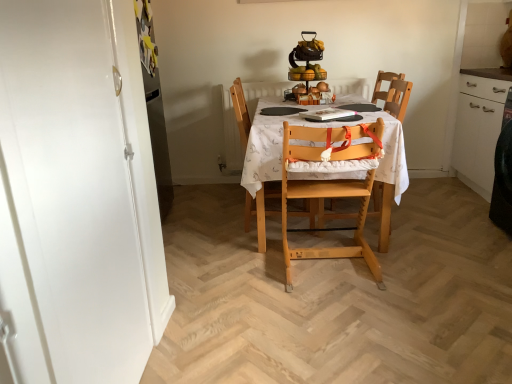
How much space does wooden highchair at center, arranged as the third chair when viewed from the left, occupy vertically?

The height of wooden highchair at center, arranged as the third chair when viewed from the left, is 35.58 inches.

The width and height of the screenshot is (512, 384). What do you see at coordinates (315, 127) in the screenshot? I see `white printed fabric at center` at bounding box center [315, 127].

Measure the distance between light wood highchair at center, which is counted as the second chair, starting from the left, and camera.

light wood highchair at center, which is counted as the second chair, starting from the left, is 6.49 feet from camera.

In order to face light wood highchair at center, acting as the 2th chair starting from the right, should I rotate leftwards or rightwards?

Rotate your view right by about 9.900°.

Where is `wooden highchair at center, marked as the first chair in a right-to-left arrangement`? wooden highchair at center, marked as the first chair in a right-to-left arrangement is located at coordinates (394, 95).

Who is taller, wooden chair with cushion at center, acting as the third chair starting from the right, or wooden highchair at center, arranged as the third chair when viewed from the left?

wooden chair with cushion at center, acting as the third chair starting from the right.

Considering the positions of point (250, 198) and point (394, 114), is point (250, 198) closer or farther from the camera than point (394, 114)?

Point (250, 198) appears to be closer to the viewer than point (394, 114).

From a real-world perspective, is wooden chair with cushion at center, acting as the third chair starting from the right, above or below wooden highchair at center, arranged as the third chair when viewed from the left?

From a real-world perspective, wooden chair with cushion at center, acting as the third chair starting from the right, is physically above wooden highchair at center, arranged as the third chair when viewed from the left.

Which is behind, wooden chair with cushion at center, acting as the third chair starting from the right, or wooden highchair at center, marked as the first chair in a right-to-left arrangement?

wooden chair with cushion at center, acting as the third chair starting from the right, is further from the camera.

Looking at this image, considering the sizes of objects wooden highchair at center, arranged as the third chair when viewed from the left, and wooden chair with cushion at center, acting as the third chair starting from the right, in the image provided, who is thinner, wooden highchair at center, arranged as the third chair when viewed from the left, or wooden chair with cushion at center, acting as the third chair starting from the right,?

With smaller width is wooden highchair at center, arranged as the third chair when viewed from the left.

From a real-world perspective, between wooden highchair at center, arranged as the third chair when viewed from the left, and wooden chair with cushion at center, the 1th chair in the left-to-right sequence, who is vertically lower?

wooden highchair at center, arranged as the third chair when viewed from the left, is physically lower.

From the image's perspective, starting from the wooden chair with cushion at center, the 1th chair in the left-to-right sequence, which chair is the 1st one below? Please provide its 2D coordinates.

[(394, 95)]

Considering the points (390, 186) and (231, 87), which point is behind, point (390, 186) or point (231, 87)?

The point (231, 87) is farther.

Could you tell me if white printed fabric at center is turned towards light wood highchair at center, which is counted as the second chair, starting from the left?

Yes, white printed fabric at center faces towards light wood highchair at center, which is counted as the second chair, starting from the left.

Is light wood highchair at center, acting as the 2th chair starting from the right, inside white printed fabric at center?

Yes, white printed fabric at center contains light wood highchair at center, acting as the 2th chair starting from the right.

Considering the sizes of objects white printed fabric at center and light wood highchair at center, which is counted as the second chair, starting from the left, in the image provided, who is wider, white printed fabric at center or light wood highchair at center, which is counted as the second chair, starting from the left,?

Wider between the two is white printed fabric at center.

From the picture: Considering the relative sizes of white printed fabric at center and light wood highchair at center, which is counted as the second chair, starting from the left, in the image provided, is white printed fabric at center bigger than light wood highchair at center, which is counted as the second chair, starting from the left,?

Yes, white printed fabric at center is bigger than light wood highchair at center, which is counted as the second chair, starting from the left.

Between wooden chair with cushion at center, the 1th chair in the left-to-right sequence, and light wood highchair at center, which is counted as the second chair, starting from the left, which one has larger width?

Wider between the two is wooden chair with cushion at center, the 1th chair in the left-to-right sequence.

Are wooden chair with cushion at center, the 1th chair in the left-to-right sequence, and light wood highchair at center, which is counted as the second chair, starting from the left, far apart?

That's not correct — wooden chair with cushion at center, the 1th chair in the left-to-right sequence, is a little close to light wood highchair at center, which is counted as the second chair, starting from the left.

From the image's perspective, is wooden chair with cushion at center, the 1th chair in the left-to-right sequence, beneath light wood highchair at center, which is counted as the second chair, starting from the left?

No.

Which chair is the 2nd one when counting from the front of the wooden chair with cushion at center, the 1th chair in the left-to-right sequence? Please provide its 2D coordinates.

[(330, 188)]

From a real-world perspective, which object stands above the other?

In real-world perspective, wooden chair with cushion at center, the 1th chair in the left-to-right sequence, is above.

Does wooden chair with cushion at center, acting as the third chair starting from the right, turn towards white printed fabric at center?

Yes, wooden chair with cushion at center, acting as the third chair starting from the right, is aimed at white printed fabric at center.

Can you confirm if wooden chair with cushion at center, the 1th chair in the left-to-right sequence, is taller than white printed fabric at center?

Indeed, wooden chair with cushion at center, the 1th chair in the left-to-right sequence, has a greater height compared to white printed fabric at center.

From the picture: Which is in front, wooden chair with cushion at center, the 1th chair in the left-to-right sequence, or white printed fabric at center?

white printed fabric at center.

Is there a large distance between light wood highchair at center, which is counted as the second chair, starting from the left, and white printed fabric at center?

They are positioned close to each other.

From the image's perspective, who appears lower, light wood highchair at center, which is counted as the second chair, starting from the left, or white printed fabric at center?

From the image's view, light wood highchair at center, which is counted as the second chair, starting from the left, is below.

Considering the sizes of objects light wood highchair at center, acting as the 2th chair starting from the right, and white printed fabric at center in the image provided, who is thinner, light wood highchair at center, acting as the 2th chair starting from the right, or white printed fabric at center?

Thinner between the two is light wood highchair at center, acting as the 2th chair starting from the right.

From the image's perspective, between wooden highchair at center, marked as the first chair in a right-to-left arrangement, and light wood highchair at center, acting as the 2th chair starting from the right, who is located below?

light wood highchair at center, acting as the 2th chair starting from the right, from the image's perspective.

From the image's perspective, which chair is the 1st one above the light wood highchair at center, which is counted as the second chair, starting from the left? Please provide its 2D coordinates.

[(394, 95)]

Can you see wooden highchair at center, arranged as the third chair when viewed from the left, touching light wood highchair at center, which is counted as the second chair, starting from the left?

No.

How different are the orientations of wooden highchair at center, marked as the first chair in a right-to-left arrangement, and light wood highchair at center, which is counted as the second chair, starting from the left, in degrees?

wooden highchair at center, marked as the first chair in a right-to-left arrangement, and light wood highchair at center, which is counted as the second chair, starting from the left, are facing 90 degrees away from each other.

This screenshot has width=512, height=384. In order to click on chair positioned vertically above the wooden highchair at center, arranged as the third chair when viewed from the left (from a real-world perspective) in this screenshot , I will do `click(241, 111)`.

Identify the location of the 2nd chair to the left of the wooden highchair at center, marked as the first chair in a right-to-left arrangement, counting from the anchor's position. The width and height of the screenshot is (512, 384). (241, 111).

Looking at the image, which one is located further to light wood highchair at center, which is counted as the second chair, starting from the left, wooden highchair at center, arranged as the third chair when viewed from the left, or wooden chair with cushion at center, acting as the third chair starting from the right?

Among the two, wooden highchair at center, arranged as the third chair when viewed from the left, is located further to light wood highchair at center, which is counted as the second chair, starting from the left.

Which object lies nearer to the anchor point light wood highchair at center, which is counted as the second chair, starting from the left, white printed fabric at center or wooden highchair at center, arranged as the third chair when viewed from the left?

white printed fabric at center.

Which object lies nearer to the anchor point wooden chair with cushion at center, acting as the third chair starting from the right, wooden highchair at center, arranged as the third chair when viewed from the left, or white printed fabric at center?

Among the two, white printed fabric at center is located nearer to wooden chair with cushion at center, acting as the third chair starting from the right.

From the image, which object appears to be nearer to wooden chair with cushion at center, acting as the third chair starting from the right, light wood highchair at center, which is counted as the second chair, starting from the left, or wooden highchair at center, marked as the first chair in a right-to-left arrangement?

light wood highchair at center, which is counted as the second chair, starting from the left, is closer to wooden chair with cushion at center, acting as the third chair starting from the right.

From the image, which object appears to be nearer to white printed fabric at center, wooden highchair at center, arranged as the third chair when viewed from the left, or wooden chair with cushion at center, acting as the third chair starting from the right?

wooden chair with cushion at center, acting as the third chair starting from the right, is closer to white printed fabric at center.

Considering their positions, is white printed fabric at center positioned further to wooden highchair at center, arranged as the third chair when viewed from the left, than wooden chair with cushion at center, acting as the third chair starting from the right?

Based on the image, wooden chair with cushion at center, acting as the third chair starting from the right, appears to be further to wooden highchair at center, arranged as the third chair when viewed from the left.

Looking at the image, which one is located closer to wooden highchair at center, marked as the first chair in a right-to-left arrangement, wooden chair with cushion at center, the 1th chair in the left-to-right sequence, or light wood highchair at center, which is counted as the second chair, starting from the left?

light wood highchair at center, which is counted as the second chair, starting from the left.

From the image, which object appears to be nearer to white printed fabric at center, wooden chair with cushion at center, the 1th chair in the left-to-right sequence, or light wood highchair at center, acting as the 2th chair starting from the right?

Among the two, light wood highchair at center, acting as the 2th chair starting from the right, is located nearer to white printed fabric at center.

The height and width of the screenshot is (384, 512). In order to click on tablecloth between light wood highchair at center, which is counted as the second chair, starting from the left, and wooden highchair at center, marked as the first chair in a right-to-left arrangement, along the z-axis in this screenshot , I will do `click(315, 127)`.

You are a GUI agent. You are given a task and a screenshot of the screen. Output one action in this format:
    pyautogui.click(x=<x>, y=<y>)
    Task: Click on the tablecloth between wooden chair with cushion at center, acting as the third chair starting from the right, and wooden highchair at center, marked as the first chair in a right-to-left arrangement
    
    Given the screenshot: What is the action you would take?
    pyautogui.click(x=315, y=127)

Where is `tablecloth between light wood highchair at center, which is counted as the second chair, starting from the left, and wooden chair with cushion at center, acting as the third chair starting from the right, in the front-back direction`? This screenshot has height=384, width=512. tablecloth between light wood highchair at center, which is counted as the second chair, starting from the left, and wooden chair with cushion at center, acting as the third chair starting from the right, in the front-back direction is located at coordinates (315, 127).

I want to click on chair between light wood highchair at center, which is counted as the second chair, starting from the left, and wooden chair with cushion at center, the 1th chair in the left-to-right sequence, in the front-back direction, so click(x=394, y=95).